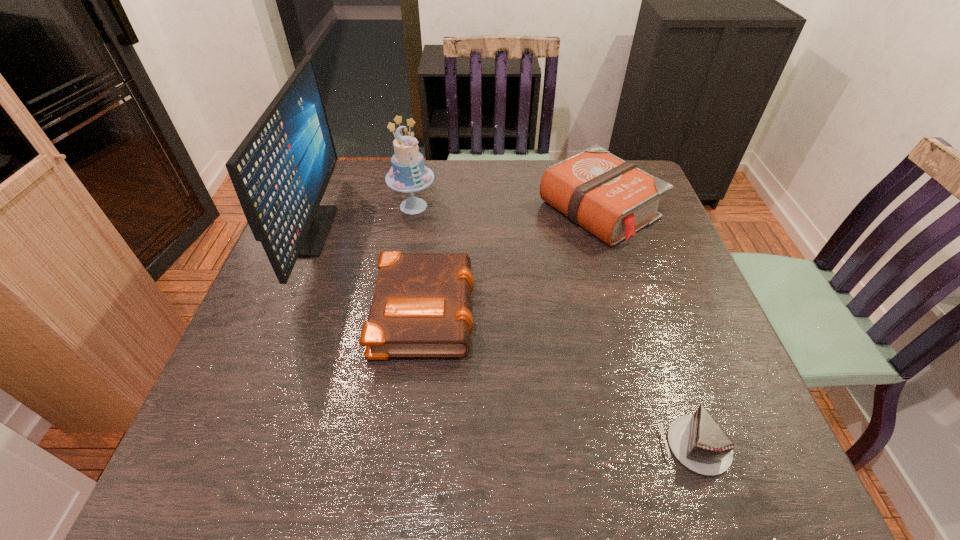
Find the location of a particular element. This screenshot has height=540, width=960. object that can be found as the fourth closest to the second shortest object is located at coordinates (697, 441).

Point out which object is positioned as the third nearest to the chocolate cake. Please provide its 2D coordinates. Your answer should be formatted as a tuple, i.e. [(x, y)], where the tuple contains the x and y coordinates of a point satisfying the conditions above.

[(408, 174)]

Locate an element on the screen. vacant region that satisfies the following two spatial constraints: 1. with a ladder on the side of the cake; 2. on the right side of the third shortest object is located at coordinates pos(413,210).

Locate an element on the screen. The image size is (960, 540). free space that satisfies the following two spatial constraints: 1. with a ladder on the side of the cake; 2. on the screen side of the tallest object is located at coordinates (409, 231).

I want to click on vacant area that satisfies the following two spatial constraints: 1. on the front side of the right Bible; 2. on the screen side of the tallest object, so click(x=605, y=231).

Locate an element on the screen. This screenshot has height=540, width=960. blank area in the image that satisfies the following two spatial constraints: 1. with a ladder on the side of the fourth shortest object; 2. on the right side of the farther Bible is located at coordinates (413, 210).

Where is `vacant space that satisfies the following two spatial constraints: 1. on the front side of the farther Bible; 2. on the right side of the nearest object`? vacant space that satisfies the following two spatial constraints: 1. on the front side of the farther Bible; 2. on the right side of the nearest object is located at coordinates pyautogui.click(x=670, y=446).

This screenshot has height=540, width=960. Identify the location of free space that satisfies the following two spatial constraints: 1. on the screen side of the shortest object; 2. on the left side of the computer monitor. (221, 446).